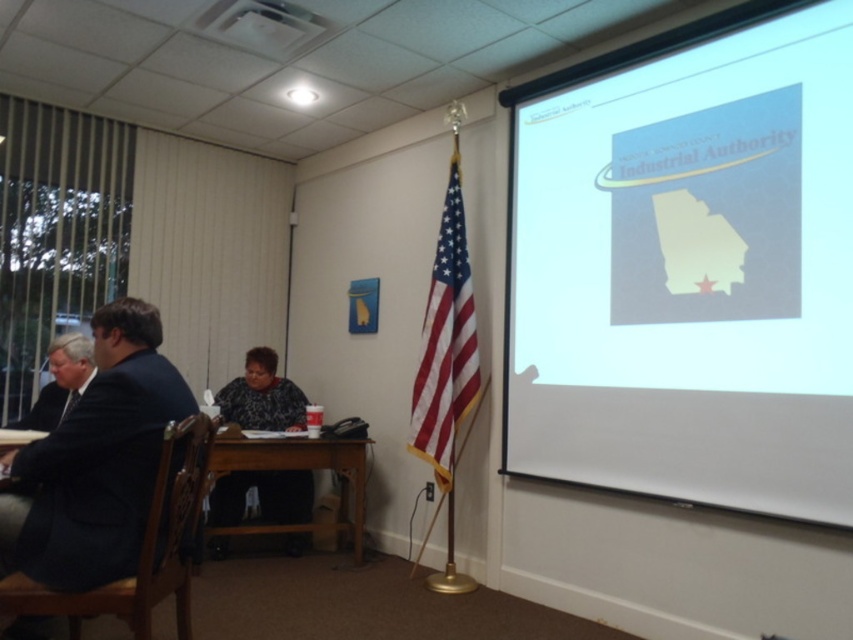
Question: From the image, what is the correct spatial relationship of patterned fabric shirt at center in relation to white plastic projector at upper center?

Choices:
 (A) right
 (B) left

Answer: (B)

Question: Which of the following is the farthest from the observer?

Choices:
 (A) (286, 426)
 (B) (456, 168)
 (C) (229, 458)
 (D) (265, 19)

Answer: (A)

Question: Which of the following is the farthest from the observer?

Choices:
 (A) (248, 442)
 (B) (660, 285)
 (C) (461, 388)

Answer: (A)

Question: Does white matte projection screen at upper right appear under white plastic projector at upper center?

Choices:
 (A) no
 (B) yes

Answer: (B)

Question: Which of the following is the closest to the observer?

Choices:
 (A) white matte projection screen at upper right
 (B) patterned fabric shirt at center

Answer: (A)

Question: Is patterned fabric shirt at center above white plastic projector at upper center?

Choices:
 (A) no
 (B) yes

Answer: (A)